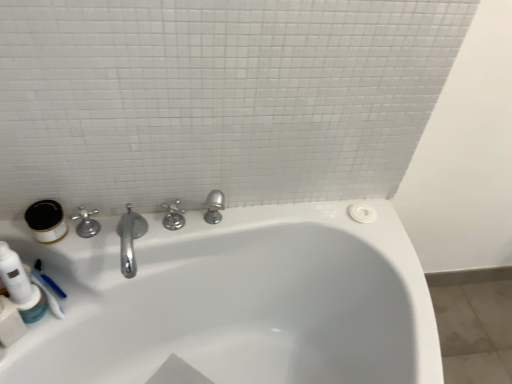
Image resolution: width=512 pixels, height=384 pixels. I want to click on free spot to the right of polished chrome faucet at left, placed as the 2th tap when sorted from right to left, so click(x=136, y=230).